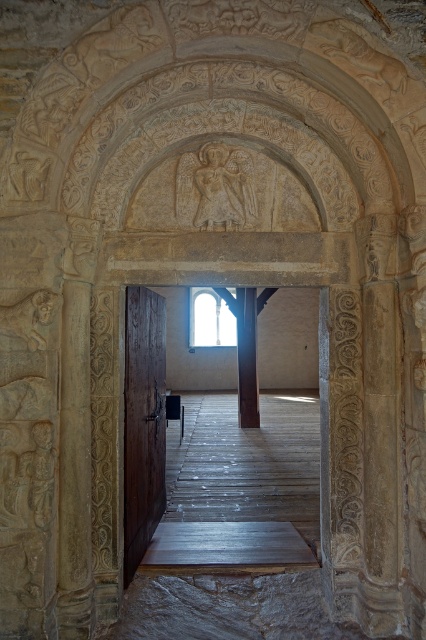
Does wooden floor at center appear on the left side of brown wooden door at center?

Correct, you'll find wooden floor at center to the left of brown wooden door at center.

Measure the distance from wooden floor at center to brown wooden door at center.

wooden floor at center is 6.16 inches from brown wooden door at center.

Between point (253, 310) and point (132, 544), which one is positioned behind?

The point (253, 310) is behind.

Where is `wooden floor at center`? This screenshot has width=426, height=640. wooden floor at center is located at coordinates (144, 422).

Is wooden floor at center smaller than clear glass window at center?

Correct, wooden floor at center occupies less space than clear glass window at center.

Is point (161, 394) in front of point (210, 324)?

Yes, point (161, 394) is closer to viewer.

You are a GUI agent. You are given a task and a screenshot of the screen. Output one action in this format:
    pyautogui.click(x=<x>, y=<y>)
    Task: Click on the wooden floor at center
    The height and width of the screenshot is (640, 426).
    Given the screenshot: What is the action you would take?
    pyautogui.click(x=144, y=422)

Is dark wood pillar at center further to camera compared to clear glass window at center?

No, it is in front of clear glass window at center.

Does dark wood pillar at center appear on the left side of clear glass window at center?

No, dark wood pillar at center is not to the left of clear glass window at center.

Measure the distance between dark wood pillar at center and camera.

A distance of 27.61 feet exists between dark wood pillar at center and camera.

Where is `dark wood pillar at center`? dark wood pillar at center is located at coordinates (247, 356).